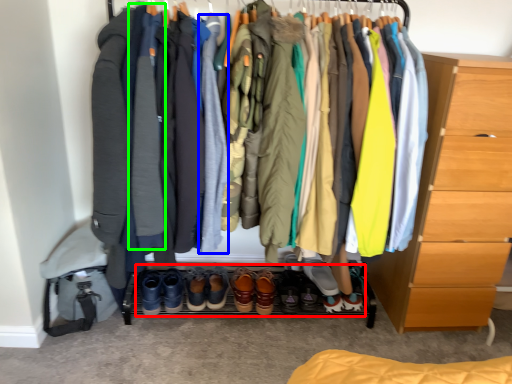
Question: Estimate the real-world distances between objects in this image. Which object is closer to footwear (highlighted by a red box), robe (highlighted by a blue box) or robe (highlighted by a green box)?

Choices:
 (A) robe
 (B) robe

Answer: (A)